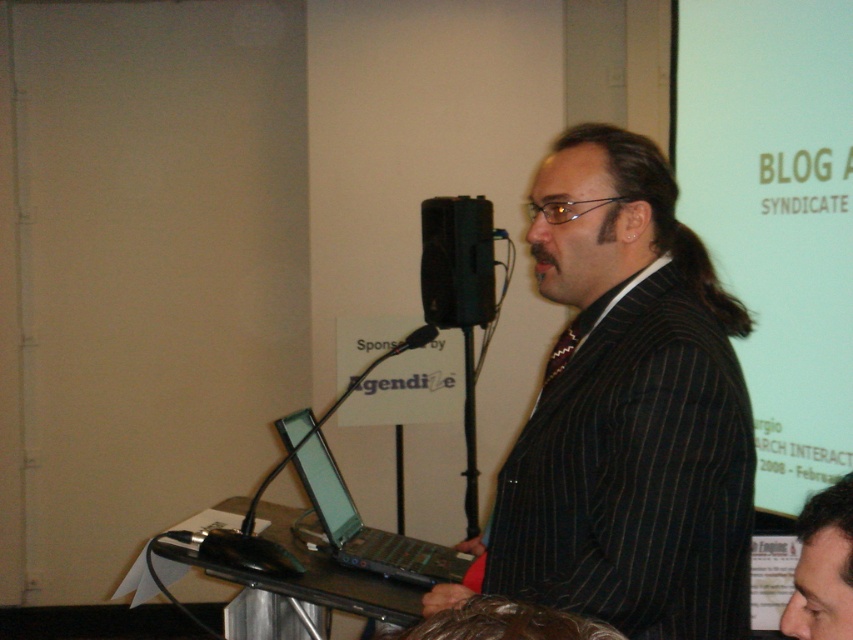
Which is above, black plastic laptop at lower left or black plastic speaker at center?

black plastic speaker at center is higher up.

The image size is (853, 640). What do you see at coordinates (369, 528) in the screenshot? I see `black plastic laptop at lower left` at bounding box center [369, 528].

Identify the location of black plastic laptop at lower left. (369, 528).

Identify the location of black plastic speaker at center. Image resolution: width=853 pixels, height=640 pixels. (456, 260).

Who is more distant from viewer, (439, 280) or (825, 545)?

Point (439, 280)

Locate an element on the screen. This screenshot has width=853, height=640. black plastic speaker at center is located at coordinates [x=456, y=260].

Find the location of a particular element. The width and height of the screenshot is (853, 640). black plastic speaker at center is located at coordinates (456, 260).

Where is `matte white projection screen at upper right`? matte white projection screen at upper right is located at coordinates (776, 216).